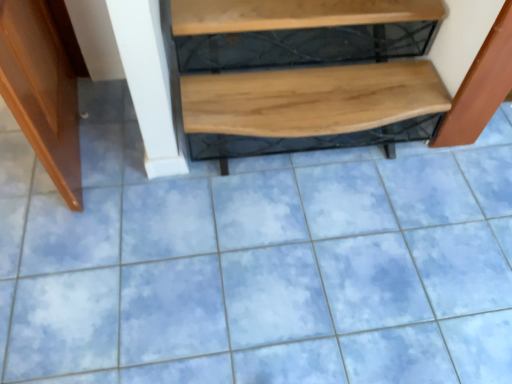
What is the approximate height of natural wood bench at center?

The height of natural wood bench at center is 12.04 inches.

This screenshot has height=384, width=512. Find the location of `shiny brown door at left`. shiny brown door at left is located at coordinates (42, 91).

In order to face wooden bench at right, should I rotate leftwards or rightwards?

To align with it, rotate right about 28.759°.

The image size is (512, 384). Identify the location of wooden at upper center. (302, 47).

Is wooden bench at right smaller than wooden at upper center?

Indeed, wooden bench at right has a smaller size compared to wooden at upper center.

How much distance is there between wooden bench at right and wooden at upper center?

wooden bench at right and wooden at upper center are 16.46 inches apart.

In the scene shown: From a real-world perspective, between wooden bench at right and wooden at upper center, who is vertically higher?

wooden at upper center.

From the image's perspective, is wooden bench at right located above wooden at upper center?

No, from the image's perspective, wooden bench at right is not above wooden at upper center.

Is wooden at upper center taller or shorter than wooden bench at right?

wooden at upper center is shorter than wooden bench at right.

Is wooden at upper center situated inside wooden bench at right or outside?

wooden at upper center is not inside wooden bench at right, it's outside.

Is wooden at upper center further to camera compared to wooden bench at right?

Yes, wooden at upper center is further from the viewer.

Would you consider wooden at upper center to be distant from wooden bench at right?

No, there isn't a large distance between wooden at upper center and wooden bench at right.

Between natural wood bench at center and shiny brown door at left, which one has smaller width?

With smaller width is shiny brown door at left.

From a real-world perspective, who is located lower, natural wood bench at center or shiny brown door at left?

natural wood bench at center, from a real-world perspective.

Is natural wood bench at center turned away from shiny brown door at left?

No, natural wood bench at center's orientation is not away from shiny brown door at left.

From the picture: Is natural wood bench at center situated inside shiny brown door at left or outside?

natural wood bench at center lies outside shiny brown door at left.

From a real-world perspective, is wooden bench at right positioned above or below natural wood bench at center?

From a real-world perspective, wooden bench at right is physically above natural wood bench at center.

Do you think wooden bench at right is within natural wood bench at center, or outside of it?

wooden bench at right is not enclosed by natural wood bench at center.

Can you confirm if wooden bench at right is wider than natural wood bench at center?

No.

Does point (510, 13) come in front of point (362, 10)?

Yes, it is in front of point (362, 10).

Considering the sizes of objects wooden at upper center and shiny brown door at left in the image provided, who is wider, wooden at upper center or shiny brown door at left?

With larger width is wooden at upper center.

In the image, there is a wooden at upper center. At what (x,y) coordinates should I click in order to perform the action: click on furniture below it (from a real-world perspective). Please return your answer as a coordinate pair (x, y). Image resolution: width=512 pixels, height=384 pixels. Looking at the image, I should click on (42, 91).

Is wooden at upper center taller or shorter than shiny brown door at left?

wooden at upper center is shorter than shiny brown door at left.

Which object is further away from the camera taking this photo, wooden at upper center or shiny brown door at left?

Positioned behind is wooden at upper center.

Which of these two, shiny brown door at left or wooden bench at right, is thinner?

With smaller width is wooden bench at right.

Looking at this image, is shiny brown door at left bigger or smaller than wooden bench at right?

In the image, shiny brown door at left appears to be larger than wooden bench at right.

Is shiny brown door at left far away from wooden bench at right?

Yes, shiny brown door at left is far from wooden bench at right.

Is wooden at upper center surrounding natural wood bench at center?

No, natural wood bench at center is located outside of wooden at upper center.

Considering the points (339, 50) and (430, 87), which point is behind, point (339, 50) or point (430, 87)?

The point (339, 50) is farther.

From a real-world perspective, relative to natural wood bench at center, is wooden at upper center vertically above or below?

From a real-world perspective, wooden at upper center is physically above natural wood bench at center.

Locate an element on the screen. This screenshot has width=512, height=384. shelf lying behind the wooden bench at right is located at coordinates (302, 47).

The image size is (512, 384). I want to click on shelf that appears above the wooden bench at right (from the image's perspective), so click(x=302, y=47).

When comparing their distances from wooden at upper center, does natural wood bench at center or wooden bench at right seem further?

wooden bench at right is further to wooden at upper center.

Based on the photo, estimate the real-world distances between objects in this image. Which object is closer to shiny brown door at left, wooden at upper center or natural wood bench at center?

Among the two, wooden at upper center is located nearer to shiny brown door at left.

From the image, which object appears to be nearer to wooden at upper center, shiny brown door at left or wooden bench at right?

wooden bench at right.

Considering their positions, is wooden at upper center positioned further to wooden bench at right than natural wood bench at center?

wooden at upper center.

Based on their spatial positions, is shiny brown door at left or natural wood bench at center closer to wooden bench at right?

natural wood bench at center is closer to wooden bench at right.

When comparing their distances from shiny brown door at left, does natural wood bench at center or wooden at upper center seem further?

Based on the image, natural wood bench at center appears to be further to shiny brown door at left.

Based on their spatial positions, is natural wood bench at center or wooden bench at right further from shiny brown door at left?

wooden bench at right is further to shiny brown door at left.

Based on their spatial positions, is shiny brown door at left or natural wood bench at center closer to wooden at upper center?

The object closer to wooden at upper center is natural wood bench at center.

The width and height of the screenshot is (512, 384). Find the location of `shelf between shiny brown door at left and natural wood bench at center from left to right`. shelf between shiny brown door at left and natural wood bench at center from left to right is located at coordinates (302, 47).

Identify the location of stairwell situated between shiny brown door at left and wooden bench at right from left to right. (305, 72).

You are a GUI agent. You are given a task and a screenshot of the screen. Output one action in this format:
    pyautogui.click(x=<x>, y=<y>)
    Task: Click on the stairwell between wooden at upper center and wooden bench at right in the horizontal direction
    This screenshot has height=384, width=512.
    Given the screenshot: What is the action you would take?
    pyautogui.click(x=305, y=72)

Find the location of a particular element. This screenshot has width=512, height=384. shelf located between shiny brown door at left and wooden bench at right in the left-right direction is located at coordinates (302, 47).